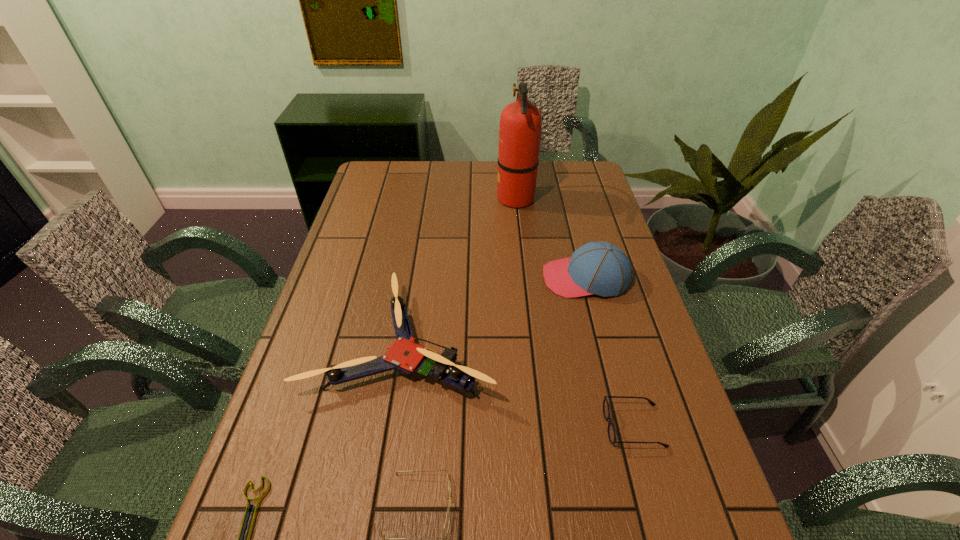
You are a GUI agent. You are given a task and a screenshot of the screen. Output one action in this format:
    pyautogui.click(x=<x>, y=<y>)
    Task: Click on the free location at the left edge
    Image resolution: width=960 pixels, height=540 pixels.
    Given the screenshot: What is the action you would take?
    pyautogui.click(x=361, y=230)

Where is `vacant point at the right edge`? vacant point at the right edge is located at coordinates (582, 233).

I want to click on free area in between the fourth shortest object and the second tallest object, so click(x=494, y=310).

Identify the location of empty space between the right spectacles and the baseball cap. This screenshot has height=540, width=960. (610, 352).

Where is `free space between the second tallest object and the drone`? Image resolution: width=960 pixels, height=540 pixels. free space between the second tallest object and the drone is located at coordinates (494, 310).

In order to click on free space that is in between the drone and the baseball cap in this screenshot , I will do `click(494, 310)`.

The height and width of the screenshot is (540, 960). What are the coordinates of `free space between the baseball cap and the farther spectacles` in the screenshot? It's located at (610, 352).

Find the location of a particular element. vacant point located between the fifth shortest object and the fire extinguisher is located at coordinates (550, 238).

Locate which object is the third closest to the baseball cap. Please provide its 2D coordinates. Your answer should be formatted as a tuple, i.e. [(x, y)], where the tuple contains the x and y coordinates of a point satisfying the conditions above.

[(606, 411)]

Select which object appears as the second closest to the shortest object. Please provide its 2D coordinates. Your answer should be formatted as a tuple, i.e. [(x, y)], where the tuple contains the x and y coordinates of a point satisfying the conditions above.

[(447, 521)]